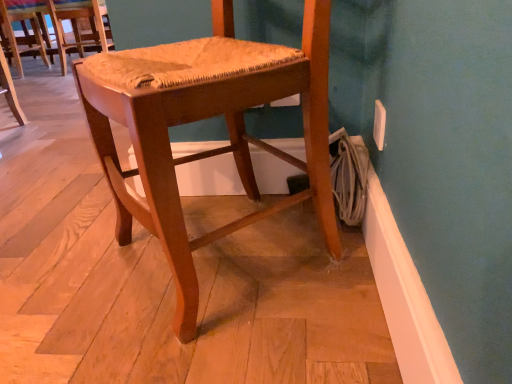
This screenshot has width=512, height=384. What do you see at coordinates (58, 25) in the screenshot? I see `woven wood chair at center, which appears as the 2th chair when viewed from the right` at bounding box center [58, 25].

What is the approximate width of woven wood chair at center, which is counted as the 1th chair, starting from the top?

The width of woven wood chair at center, which is counted as the 1th chair, starting from the top, is 18.62 inches.

Identify the location of woven wood chair at center, which is counted as the 1th chair, starting from the back. The image size is (512, 384). (58, 25).

Describe the element at coordinates (211, 150) in the screenshot. The height and width of the screenshot is (384, 512). I see `wooden woven seat at center, the 1th chair in the right-to-left sequence` at that location.

How much space does wooden woven seat at center, marked as the second chair in a top-to-bottom arrangement, occupy vertically?

22.65 inches.

Image resolution: width=512 pixels, height=384 pixels. Find the location of `wooden woven seat at center, the 1th chair in the right-to-left sequence`. wooden woven seat at center, the 1th chair in the right-to-left sequence is located at coordinates (211, 150).

Where is `woven wood chair at center, which appears as the 2th chair when viewed from the right`? The width and height of the screenshot is (512, 384). woven wood chair at center, which appears as the 2th chair when viewed from the right is located at coordinates (58, 25).

Which is more to the right, woven wood chair at center, which appears as the 1th chair when viewed from the left, or wooden woven seat at center, marked as the 1th chair in a front-to-back arrangement?

wooden woven seat at center, marked as the 1th chair in a front-to-back arrangement.

Considering the positions of objects woven wood chair at center, which ranks as the 2th chair in front-to-back order, and wooden woven seat at center, which is the 2th chair from back to front, in the image provided, who is in front, woven wood chair at center, which ranks as the 2th chair in front-to-back order, or wooden woven seat at center, which is the 2th chair from back to front,?

wooden woven seat at center, which is the 2th chair from back to front.

Which is behind, point (86, 46) or point (262, 81)?

The point (86, 46) is behind.

From the image's perspective, is woven wood chair at center, which is counted as the 1th chair, starting from the back, positioned above or below wooden woven seat at center, which is the 2th chair from back to front?

Clearly, from the image's perspective, woven wood chair at center, which is counted as the 1th chair, starting from the back, is above wooden woven seat at center, which is the 2th chair from back to front.

From a real-world perspective, between woven wood chair at center, which appears as the 2th chair when viewed from the right, and wooden woven seat at center, which is the 2th chair from back to front, who is vertically lower?

wooden woven seat at center, which is the 2th chair from back to front.

Is woven wood chair at center, which ranks as the 2th chair in front-to-back order, wider than wooden woven seat at center, marked as the 1th chair in a front-to-back arrangement?

No, woven wood chair at center, which ranks as the 2th chair in front-to-back order, is not wider than wooden woven seat at center, marked as the 1th chair in a front-to-back arrangement.

Can you confirm if woven wood chair at center, arranged as the second chair when ordered from the bottom, is taller than wooden woven seat at center, the 2th chair from the left?

No, woven wood chair at center, arranged as the second chair when ordered from the bottom, is not taller than wooden woven seat at center, the 2th chair from the left.

Considering the sizes of objects woven wood chair at center, which is counted as the 1th chair, starting from the back, and wooden woven seat at center, marked as the second chair in a top-to-bottom arrangement, in the image provided, who is smaller, woven wood chair at center, which is counted as the 1th chair, starting from the back, or wooden woven seat at center, marked as the second chair in a top-to-bottom arrangement,?

Smaller between the two is woven wood chair at center, which is counted as the 1th chair, starting from the back.

Is woven wood chair at center, which is counted as the 1th chair, starting from the top, positioned beyond the bounds of wooden woven seat at center, marked as the 1th chair in a front-to-back arrangement?

Yes, woven wood chair at center, which is counted as the 1th chair, starting from the top, is outside of wooden woven seat at center, marked as the 1th chair in a front-to-back arrangement.

Is woven wood chair at center, arranged as the second chair when ordered from the bottom, positioned far away from wooden woven seat at center, the 1th chair in the right-to-left sequence?

Yes, woven wood chair at center, arranged as the second chair when ordered from the bottom, is far from wooden woven seat at center, the 1th chair in the right-to-left sequence.

Could you tell me if woven wood chair at center, which ranks as the 2th chair in front-to-back order, is facing wooden woven seat at center, marked as the 1th chair in a front-to-back arrangement?

No, woven wood chair at center, which ranks as the 2th chair in front-to-back order, does not turn towards wooden woven seat at center, marked as the 1th chair in a front-to-back arrangement.

Can you tell me how much woven wood chair at center, which is counted as the 1th chair, starting from the top, and wooden woven seat at center, the 1th chair in the right-to-left sequence, differ in facing direction?

The facing directions of woven wood chair at center, which is counted as the 1th chair, starting from the top, and wooden woven seat at center, the 1th chair in the right-to-left sequence, are 127 degrees apart.

Where is `chair behind the wooden woven seat at center, marked as the 1th chair in a front-to-back arrangement`? chair behind the wooden woven seat at center, marked as the 1th chair in a front-to-back arrangement is located at coordinates (58, 25).

Is wooden woven seat at center, marked as the second chair in a top-to-bottom arrangement, at the right side of woven wood chair at center, arranged as the second chair when ordered from the bottom?

Correct, you'll find wooden woven seat at center, marked as the second chair in a top-to-bottom arrangement, to the right of woven wood chair at center, arranged as the second chair when ordered from the bottom.

Which is in front, wooden woven seat at center, marked as the 1th chair in a front-to-back arrangement, or woven wood chair at center, arranged as the second chair when ordered from the bottom?

wooden woven seat at center, marked as the 1th chair in a front-to-back arrangement.

Considering the points (224, 38) and (98, 35), which point is in front, point (224, 38) or point (98, 35)?

The point (224, 38) is closer.

From the image's perspective, between wooden woven seat at center, the 2th chair from the left, and woven wood chair at center, which is counted as the 1th chair, starting from the back, who is located below?

wooden woven seat at center, the 2th chair from the left, from the image's perspective.

From a real-world perspective, is wooden woven seat at center, marked as the 1th chair in a front-to-back arrangement, under woven wood chair at center, which is counted as the 1th chair, starting from the back?

Indeed, from a real-world perspective, wooden woven seat at center, marked as the 1th chair in a front-to-back arrangement, is positioned beneath woven wood chair at center, which is counted as the 1th chair, starting from the back.

Which object is wider, wooden woven seat at center, marked as the 1th chair in a front-to-back arrangement, or woven wood chair at center, arranged as the second chair when ordered from the bottom?

wooden woven seat at center, marked as the 1th chair in a front-to-back arrangement, is wider.

Does wooden woven seat at center, marked as the second chair in a top-to-bottom arrangement, have a greater height compared to woven wood chair at center, which appears as the 1th chair when viewed from the left?

Yes, wooden woven seat at center, marked as the second chair in a top-to-bottom arrangement, is taller than woven wood chair at center, which appears as the 1th chair when viewed from the left.

Consider the image. Can you confirm if wooden woven seat at center, the 2th chair from the left, is smaller than woven wood chair at center, which appears as the 2th chair when viewed from the right?

Incorrect, wooden woven seat at center, the 2th chair from the left, is not smaller in size than woven wood chair at center, which appears as the 2th chair when viewed from the right.

Is wooden woven seat at center, marked as the 1th chair in a front-to-back arrangement, completely or partially outside of woven wood chair at center, which ranks as the 2th chair in front-to-back order?

Yes, wooden woven seat at center, marked as the 1th chair in a front-to-back arrangement, is outside of woven wood chair at center, which ranks as the 2th chair in front-to-back order.

Is wooden woven seat at center, marked as the second chair in a top-to-bottom arrangement, directly adjacent to woven wood chair at center, arranged as the second chair when ordered from the bottom?

They are not placed beside each other.

Is wooden woven seat at center, the 2th chair from the left, facing away from woven wood chair at center, which ranks as the 2th chair in front-to-back order?

No, wooden woven seat at center, the 2th chair from the left, is not facing the opposite direction of woven wood chair at center, which ranks as the 2th chair in front-to-back order.

How many degrees apart are the facing directions of wooden woven seat at center, marked as the 1th chair in a front-to-back arrangement, and woven wood chair at center, which is counted as the 1th chair, starting from the top?

127 degrees.

Identify the location of chair behind the wooden woven seat at center, marked as the second chair in a top-to-bottom arrangement. The height and width of the screenshot is (384, 512). (58, 25).

What are the coordinates of `chair in front of the woven wood chair at center, which is counted as the 1th chair, starting from the top` in the screenshot? It's located at (211, 150).

Locate an element on the screen. chair below the woven wood chair at center, which appears as the 2th chair when viewed from the right (from a real-world perspective) is located at coordinates (211, 150).